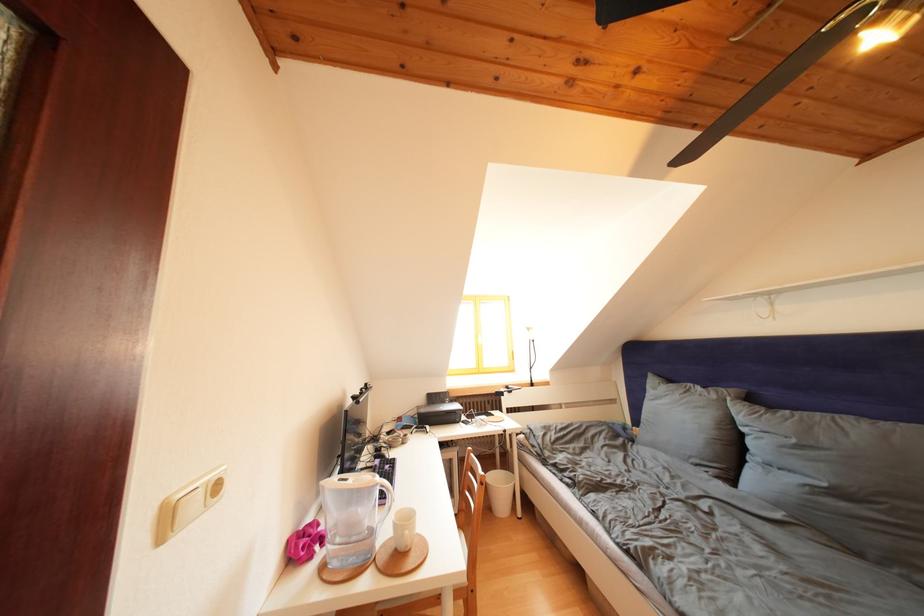
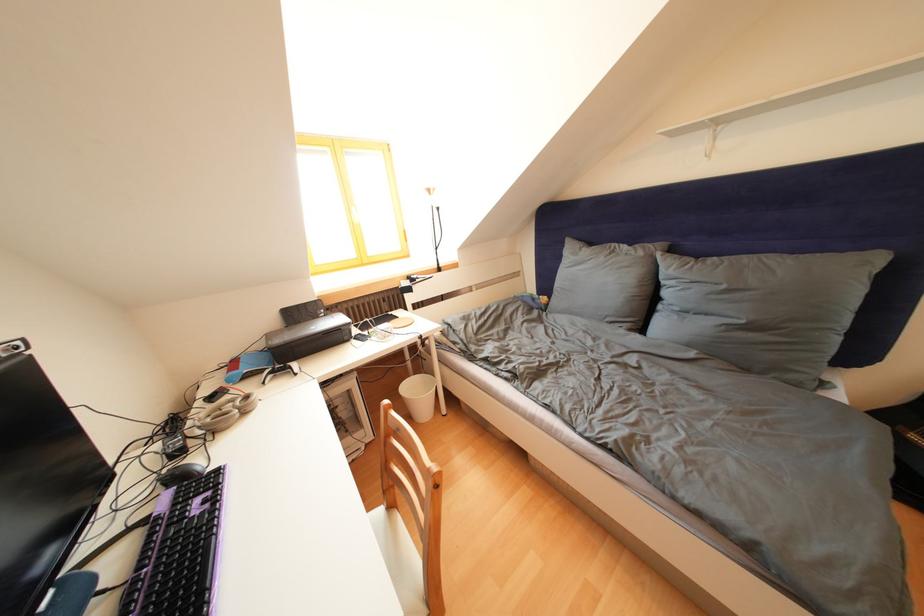
Locate, in the second image, the point that corresponds to point (396, 438) in the first image.

(220, 403)